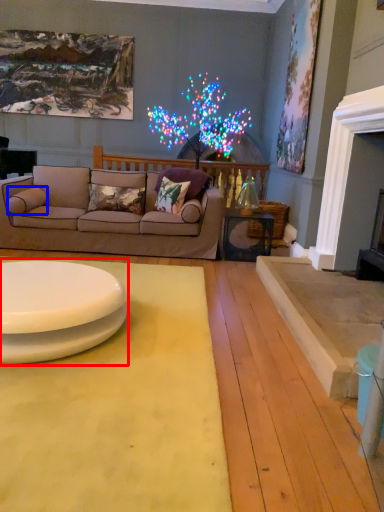
Question: Which point is closer to the camera, table (highlighted by a red box) or pillow (highlighted by a blue box)?

Choices:
 (A) table
 (B) pillow

Answer: (A)